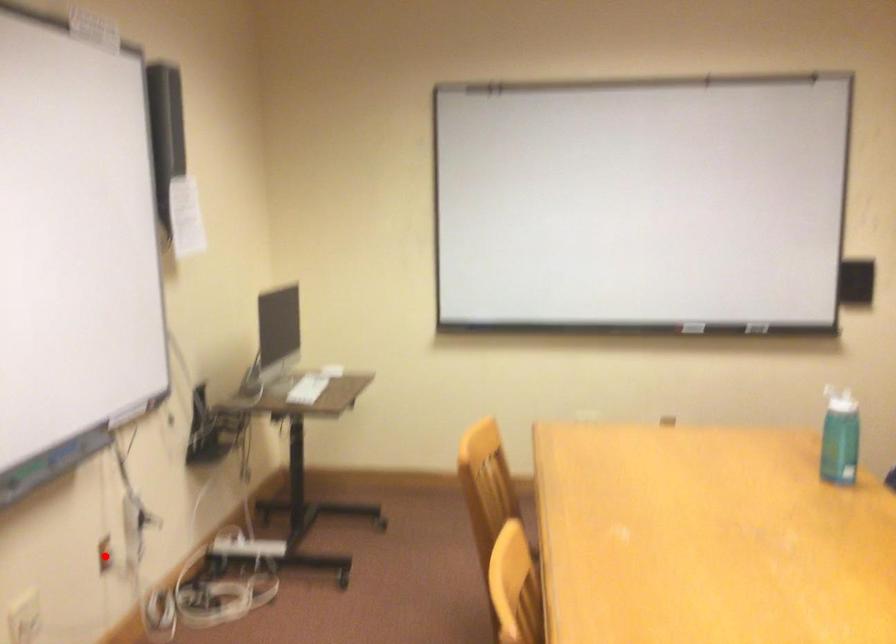
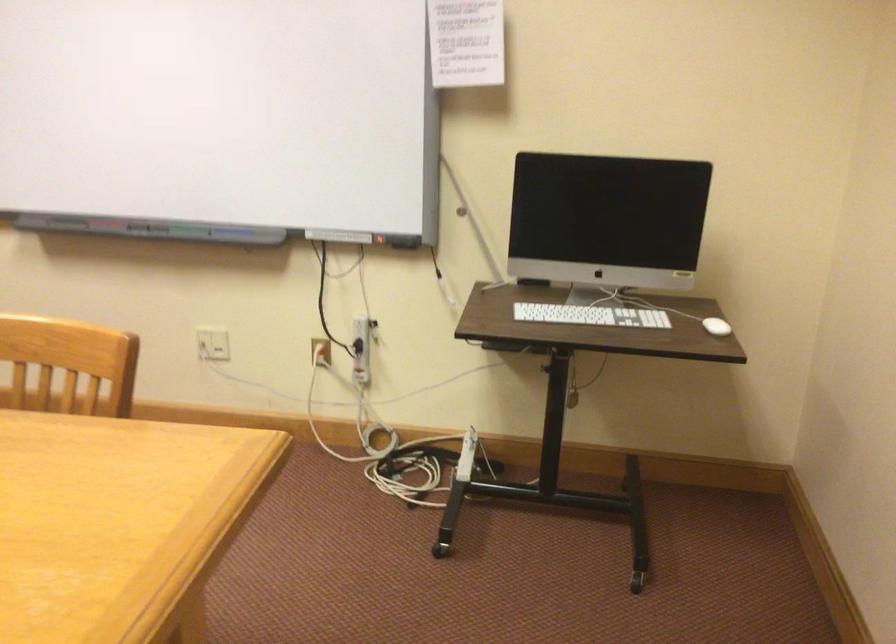
Locate, in the second image, the point that corresponds to the highlighted location in the first image.

(321, 351)